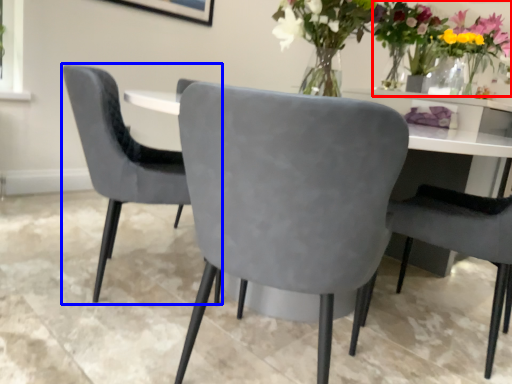
Question: Which object is further to the camera taking this photo, floral arrangement (highlighted by a red box) or chair (highlighted by a blue box)?

Choices:
 (A) floral arrangement
 (B) chair

Answer: (A)